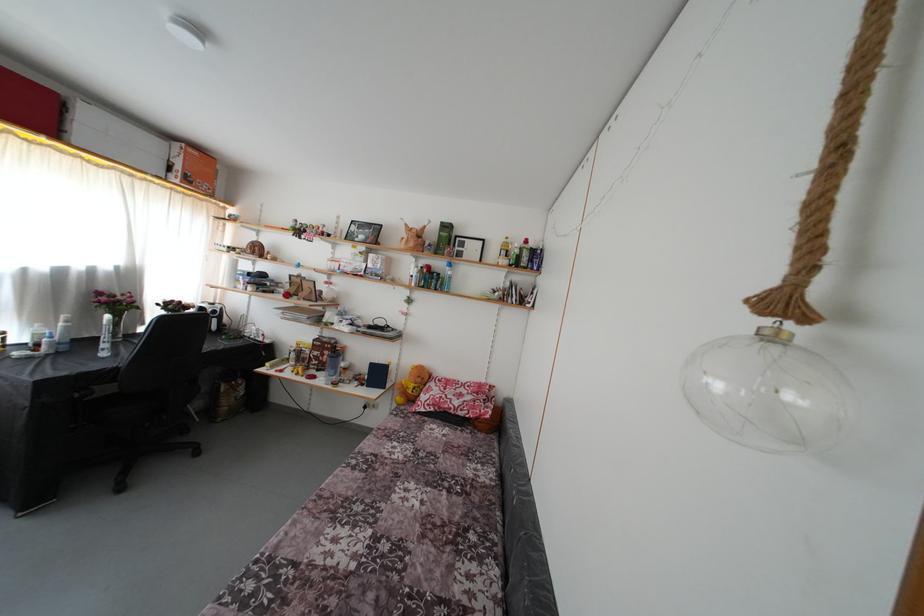
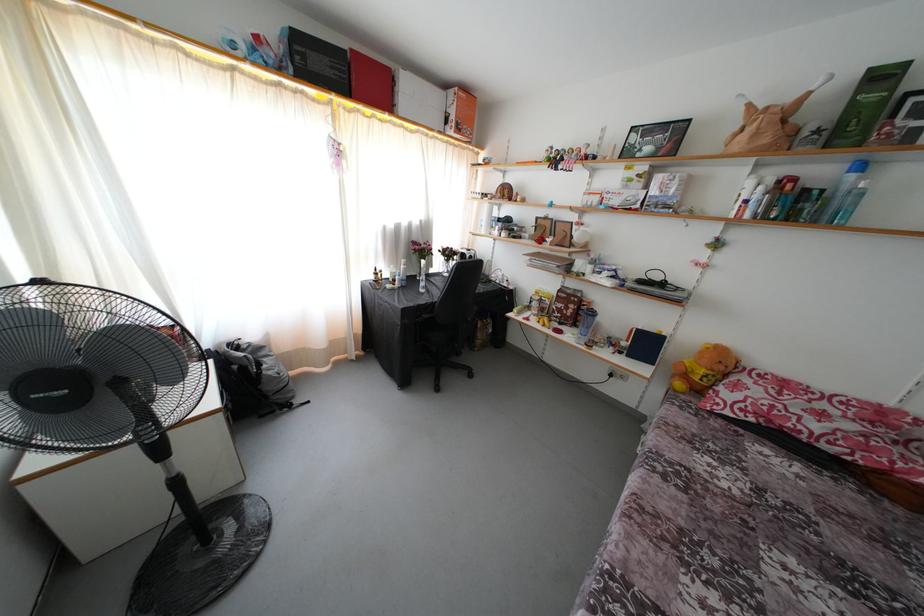
Where in the second image is the point corresponding to (x=451, y=270) from the first image?

(849, 172)